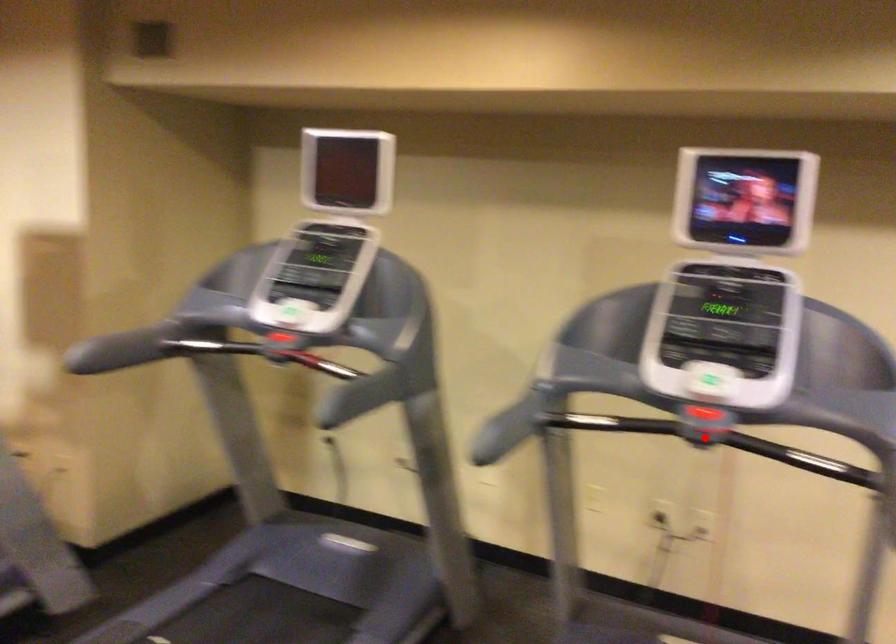
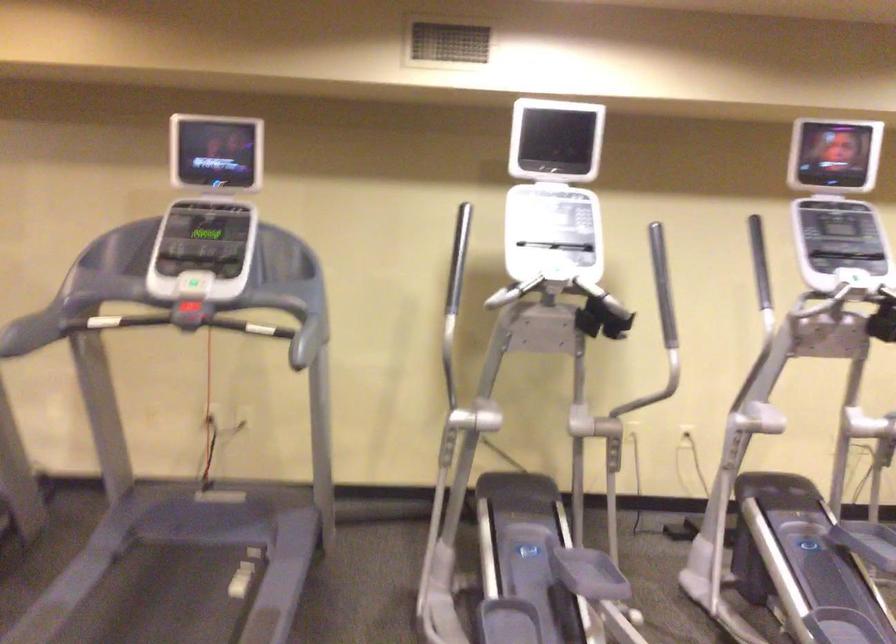
The point at the highlighted location is marked in the first image. Where is the corresponding point in the second image?

(187, 321)